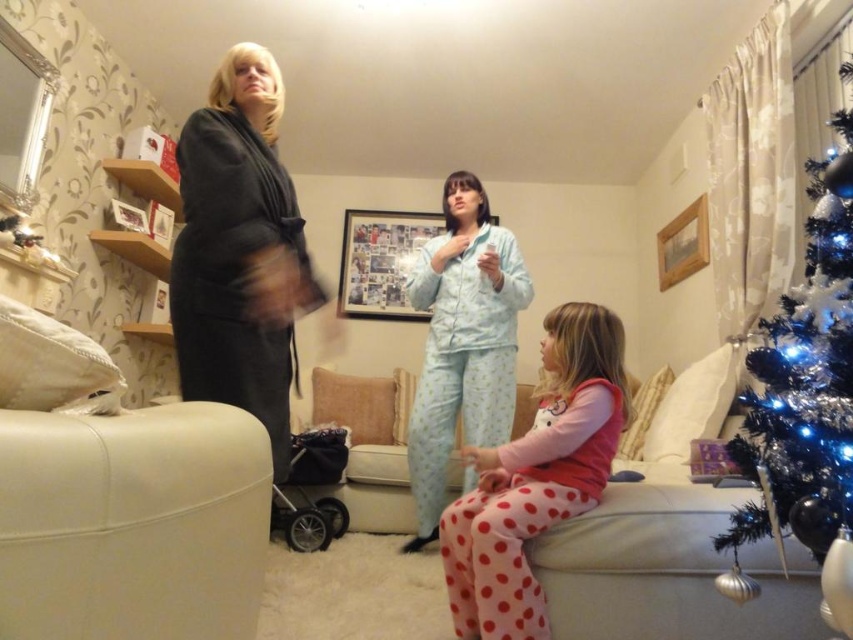
Between dark gray robe at left and shiny metallic tree at right, which one has less height?

shiny metallic tree at right is shorter.

Identify the location of dark gray robe at left. (239, 250).

The height and width of the screenshot is (640, 853). I want to click on dark gray robe at left, so click(239, 250).

Is shiny metallic tree at right to the left of light blue cotton pajamas at center from the viewer's perspective?

Incorrect, shiny metallic tree at right is not on the left side of light blue cotton pajamas at center.

Can you confirm if shiny metallic tree at right is positioned to the right of light blue cotton pajamas at center?

Correct, you'll find shiny metallic tree at right to the right of light blue cotton pajamas at center.

At what (x,y) coordinates should I click in order to perform the action: click on shiny metallic tree at right. Please return your answer as a coordinate pair (x, y). The image size is (853, 640). Looking at the image, I should click on tap(808, 369).

Who is positioned more to the left, white leather armchair at lower left or shiny metallic tree at right?

white leather armchair at lower left

In the scene shown: Can you confirm if white leather armchair at lower left is thinner than shiny metallic tree at right?

Correct, white leather armchair at lower left's width is less than shiny metallic tree at right's.

Does point (239, 600) lie in front of point (784, 508)?

Yes, point (239, 600) is closer to viewer.

Image resolution: width=853 pixels, height=640 pixels. I want to click on white leather armchair at lower left, so click(122, 504).